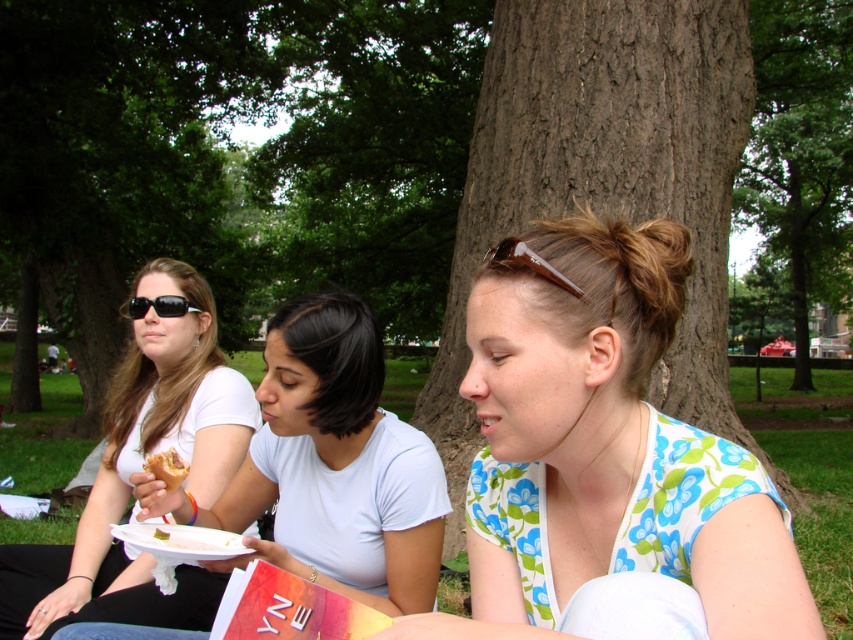
You are a photographer trying to capture a candid shot of the golden bread at center without including the floral print blouse at center in the frame. Based on their positions, is this possible?

The floral print blouse at center is located above the golden bread at center, so it would block the view of the golden bread at center. Therefore, capturing the golden bread at center without the blouse would not be possible from this angle.